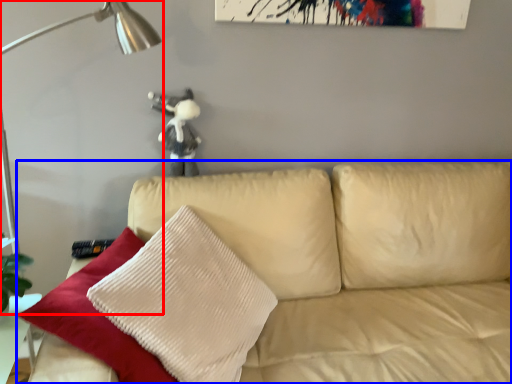
Question: Which object appears closest to the camera in this image, table lamp (highlighted by a red box) or studio couch (highlighted by a blue box)?

Choices:
 (A) table lamp
 (B) studio couch

Answer: (B)